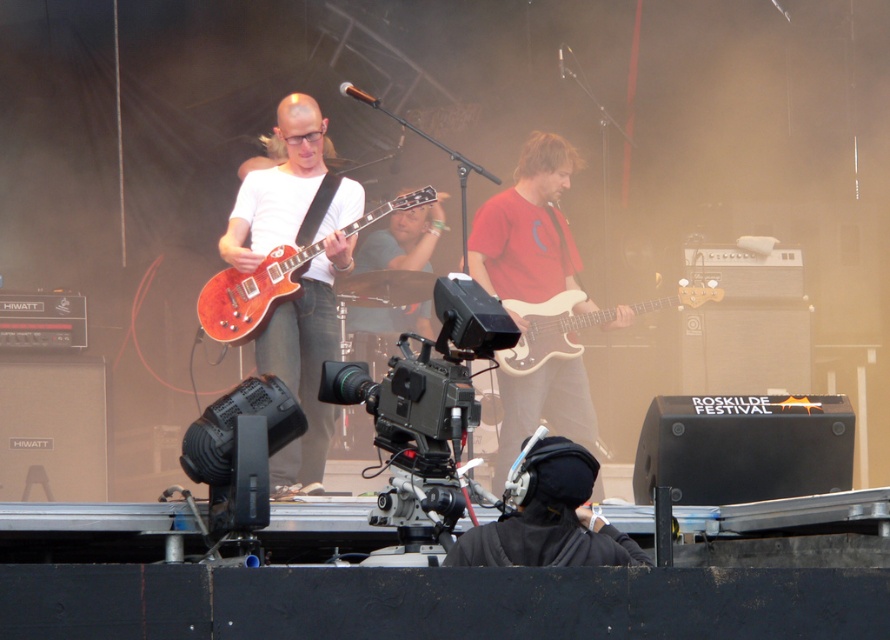
You are a photographer at the Roskilde Festival. You want to capture a closeup shot of the black matte headphones at center and the glossy wood guitar at center. Which object will appear larger in your photo?

The black matte headphones at center will appear larger in the photo because they are closer to the viewer than the glossy wood guitar at center.

You are a photographer at the Roskilde Festival. You want to capture a closeup of the glossy wood guitar at center. The camera you are using has a focus point at coordinate point [252,292]. Will this focus point align with the guitar?

Yes, the glossy wood guitar at center is located at point [252,292], so the focus point will align with the guitar.

You are a photographer at the Roskilde Festival trying to capture a shot of the red matte guitar at center and the white matte bass guitar at center. You want to frame the image so that both instruments are visible without any overlap. Given their positions, is this possible?

The white matte bass guitar at center is behind the red matte guitar at center, so there will be overlap between them. To avoid overlap, the photographer would need to adjust the angle or position to ensure the white matte bass guitar at center is not obscured by the red matte guitar at center.